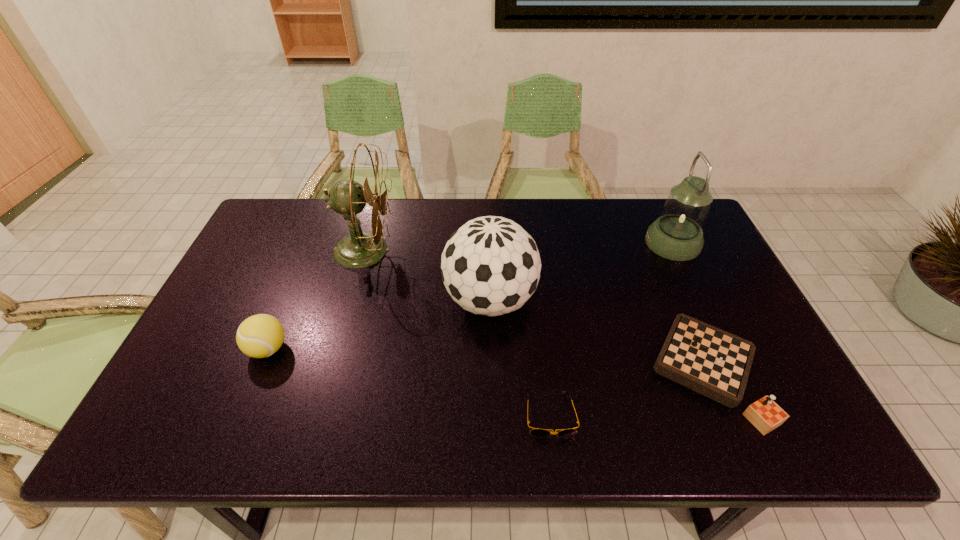
You are a GUI agent. You are given a task and a screenshot of the screen. Output one action in this format:
    pyautogui.click(x=<x>, y=<y>)
    Task: Click on the object located in the near right corner section of the desktop
    This screenshot has height=540, width=960.
    Given the screenshot: What is the action you would take?
    pyautogui.click(x=710, y=361)

At what (x,y) coordinates should I click in order to perform the action: click on vacant area at the far edge of the desktop. Please return your answer as a coordinate pair (x, y). The image size is (960, 540). Looking at the image, I should click on (472, 218).

The width and height of the screenshot is (960, 540). In the image, there is a desktop. What are the coordinates of `blank space at the near edge` in the screenshot? It's located at (224, 430).

The height and width of the screenshot is (540, 960). In order to click on free region at the left edge in this screenshot , I will do `click(266, 255)`.

This screenshot has height=540, width=960. I want to click on vacant position at the right edge of the desktop, so click(730, 308).

This screenshot has width=960, height=540. I want to click on vacant space at the near left corner, so click(206, 426).

At what (x,y) coordinates should I click in order to perform the action: click on free spot at the far right corner of the desktop. Please return your answer as a coordinate pair (x, y). This screenshot has height=540, width=960. Looking at the image, I should click on (652, 213).

At what (x,y) coordinates should I click in order to perform the action: click on free area in between the sunglasses and the lantern. Please return your answer as a coordinate pair (x, y). This screenshot has width=960, height=540. Looking at the image, I should click on (612, 329).

Where is `free space that is in between the fan and the third shortest object`? free space that is in between the fan and the third shortest object is located at coordinates (316, 300).

In order to click on empty space that is in between the shortest object and the soccer ball in this screenshot , I will do `click(520, 357)`.